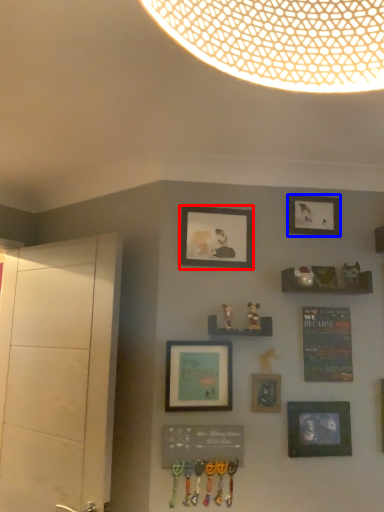
Question: Among these objects, which one is nearest to the camera, picture frame (highlighted by a red box) or picture frame (highlighted by a blue box)?

Choices:
 (A) picture frame
 (B) picture frame

Answer: (A)